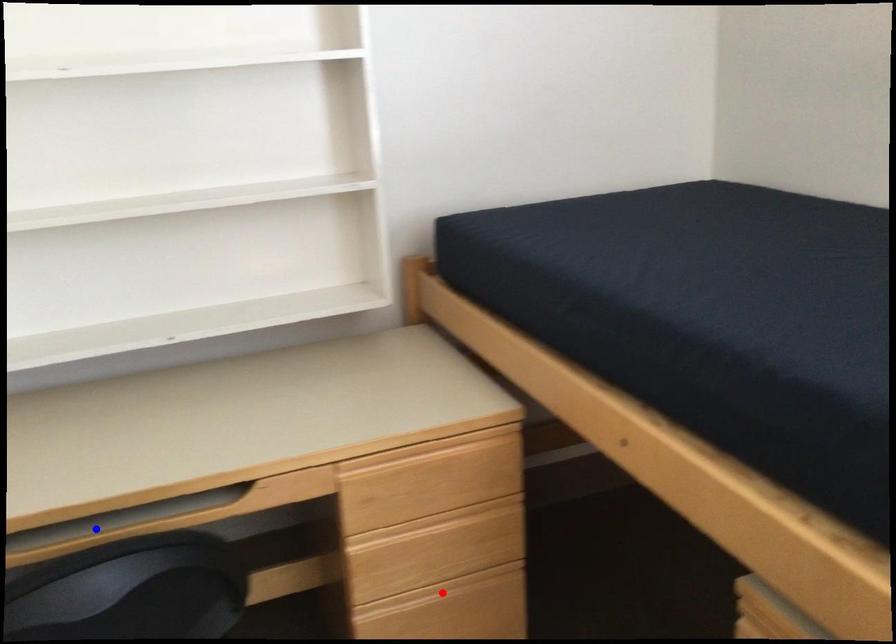
Question: Which of the two points in the image is closer to the camera?

Choices:
 (A) Blue point is closer.
 (B) Red point is closer.

Answer: (A)